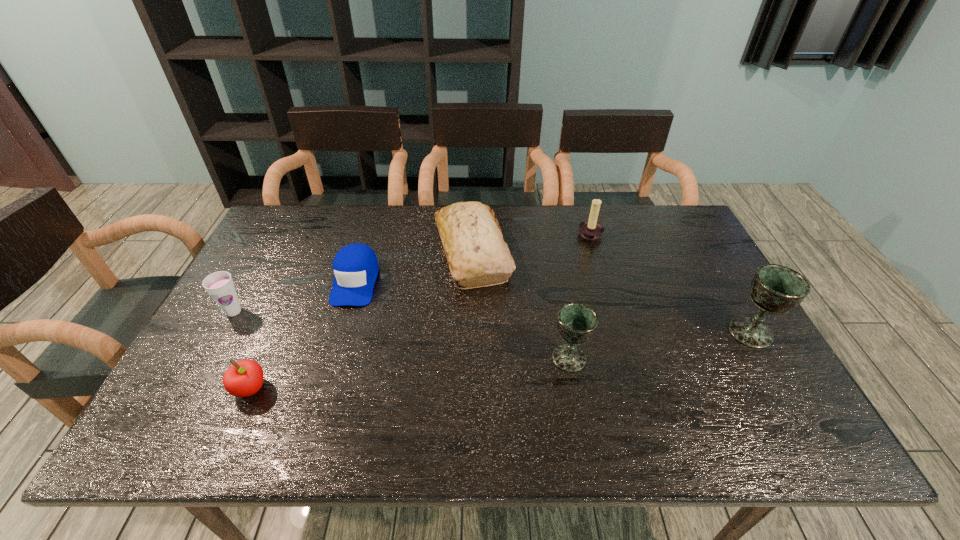
The width and height of the screenshot is (960, 540). I want to click on vacant space at the far left corner, so click(x=296, y=224).

At what (x,y) coordinates should I click in order to perform the action: click on vacant space at the far right corner of the desktop. Please return your answer as a coordinate pair (x, y). Image resolution: width=960 pixels, height=540 pixels. Looking at the image, I should click on (666, 230).

In the image, there is a desktop. Identify the location of vacant space at the near right corner. The width and height of the screenshot is (960, 540). (744, 380).

What are the coordinates of `free space between the third object from right to left and the apple` in the screenshot? It's located at (410, 373).

Locate an element on the screen. This screenshot has height=540, width=960. vacant area that lies between the second object from left to right and the second object from right to left is located at coordinates (420, 312).

I want to click on empty space between the tallest object and the fourth object from right to left, so click(612, 292).

Image resolution: width=960 pixels, height=540 pixels. In order to click on free space between the leftmost object and the apple in this screenshot , I will do `click(242, 350)`.

In order to click on vacant area between the bread and the third object from right to left in this screenshot , I will do `click(521, 305)`.

The height and width of the screenshot is (540, 960). I want to click on vacant point located between the shorter chalice and the leftmost object, so click(401, 335).

Image resolution: width=960 pixels, height=540 pixels. I want to click on free space between the right chalice and the baseball cap, so click(553, 307).